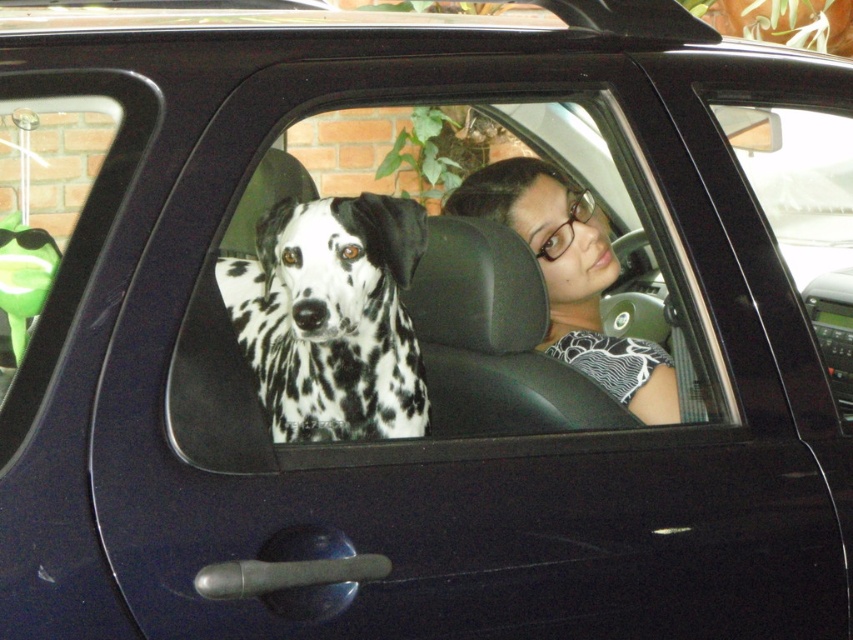
Does black leather car window at center appear on the left side of black and white spotted dog at center?

No, black leather car window at center is not to the left of black and white spotted dog at center.

Identify the location of black leather car window at center. The image size is (853, 640). (425, 365).

Is point (213, 426) farther from camera compared to point (270, 273)?

No, it is in front of (270, 273).

The image size is (853, 640). I want to click on black leather car window at center, so click(x=425, y=365).

Between black leather car window at center and matte black shirt at center, which one is positioned lower?

black leather car window at center is below.

Where is `black leather car window at center`? This screenshot has width=853, height=640. black leather car window at center is located at coordinates (425, 365).

Image resolution: width=853 pixels, height=640 pixels. I want to click on black leather car window at center, so click(x=425, y=365).

Consider the image. Is black and white spotted dog at center smaller than matte black shirt at center?

Yes.

Is point (311, 333) closer to viewer compared to point (657, 416)?

That is True.

Is point (287, 401) farther from camera compared to point (474, 189)?

No, (287, 401) is closer to viewer.

The image size is (853, 640). I want to click on black and white spotted dog at center, so click(331, 317).